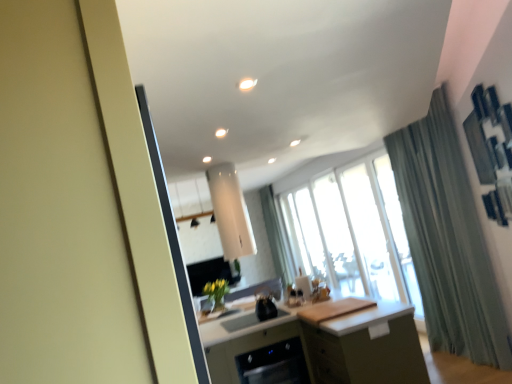
Question: Is matte white screen door at left thinner than green fabric curtain at right?

Choices:
 (A) no
 (B) yes

Answer: (A)

Question: Is green fabric curtain at right at the back of matte white screen door at left?

Choices:
 (A) no
 (B) yes

Answer: (A)

Question: From a real-world perspective, does matte white screen door at left stand above green fabric curtain at right?

Choices:
 (A) yes
 (B) no

Answer: (A)

Question: Does matte white screen door at left turn towards green fabric curtain at right?

Choices:
 (A) yes
 (B) no

Answer: (B)

Question: Are matte white screen door at left and green fabric curtain at right located far from each other?

Choices:
 (A) no
 (B) yes

Answer: (B)

Question: Considering their positions, is matte white screen door at left located in front of or behind green fabric curtain at right?

Choices:
 (A) behind
 (B) front

Answer: (B)

Question: In the image, is matte white screen door at left on the left side or the right side of green fabric curtain at right?

Choices:
 (A) right
 (B) left

Answer: (B)

Question: In terms of height, does matte white screen door at left look taller or shorter compared to green fabric curtain at right?

Choices:
 (A) tall
 (B) short

Answer: (B)

Question: Looking at their shapes, would you say matte white screen door at left is wider or thinner than green fabric curtain at right?

Choices:
 (A) thin
 (B) wide

Answer: (B)

Question: Is matte green cabinet at center inside the boundaries of transparent glass window at center, or outside?

Choices:
 (A) inside
 (B) outside

Answer: (B)

Question: Looking at their shapes, would you say matte green cabinet at center is wider or thinner than transparent glass window at center?

Choices:
 (A) wide
 (B) thin

Answer: (A)

Question: Relative to transparent glass window at center, is matte green cabinet at center in front or behind?

Choices:
 (A) front
 (B) behind

Answer: (A)

Question: Based on their positions, is matte green cabinet at center located to the left or right of transparent glass window at center?

Choices:
 (A) right
 (B) left

Answer: (B)

Question: Looking at their shapes, would you say white glossy light at upper center is wider or thinner than green fabric curtain at right?

Choices:
 (A) thin
 (B) wide

Answer: (A)

Question: Is white glossy light at upper center inside the boundaries of green fabric curtain at right, or outside?

Choices:
 (A) outside
 (B) inside

Answer: (A)